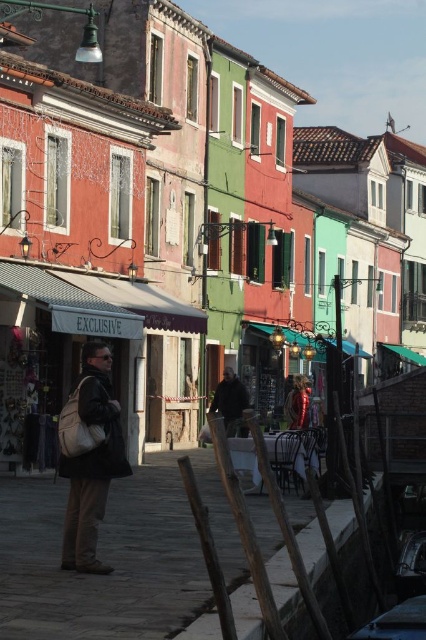
From the picture: You are a tourist walking down this picturesque street and notice a matte black backpack at center and a dark gray fabric jacket at center. Which item is located to the left of the other?

The matte black backpack at center is positioned on the left side of dark gray fabric jacket at center.

You are standing at the center of the street looking towards the shops. There are two points marked in the image, one at coordinates point (95,531) and another at point (227,374). Which point is closer to you?

Point (95,531) is closer to the viewer than point (227,374).

You are a delivery person who needs to place a package between the matte black backpack at center and the dark gray fabric jacket at center. Given that the package requires 10 feet of space, can you fit it between them?

The distance between the matte black backpack at center and the dark gray fabric jacket at center is 68.60 feet, so yes, the package requiring 10 feet of space can easily fit between them.